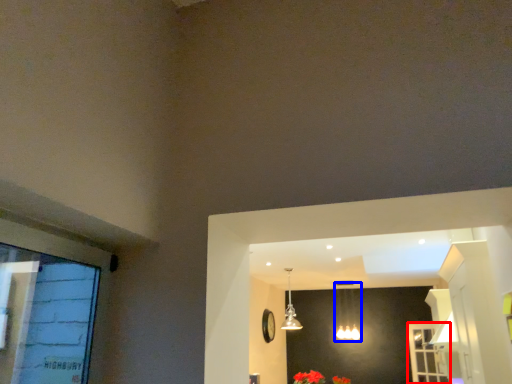
Question: Which object appears closest to the camera in this image, screen door (highlighted by a red box) or lamp (highlighted by a blue box)?

Choices:
 (A) screen door
 (B) lamp

Answer: (A)